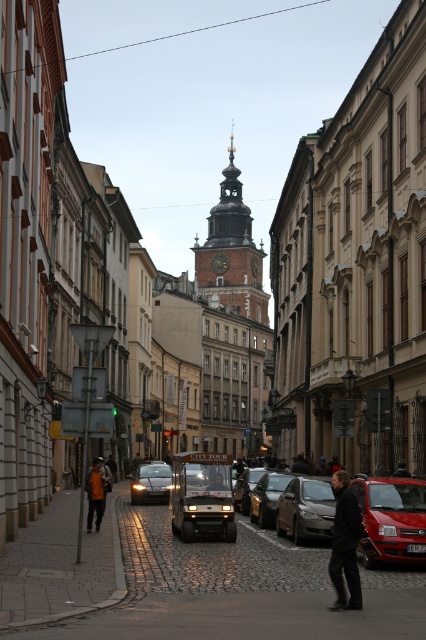
Question: Considering the real-world distances, which object is farthest from the dark gray jacket at center?

Choices:
 (A) shiny metallic car at center
 (B) matte gray sedan at center

Answer: (A)

Question: Is matte gray sedan at center positioned before dark brown leather jacket at center?

Choices:
 (A) no
 (B) yes

Answer: (B)

Question: Can you confirm if dark gray jacket at center is positioned to the right of shiny silver car at center?

Choices:
 (A) no
 (B) yes

Answer: (B)

Question: Which point is farther from the camera taking this photo?

Choices:
 (A) (406, 493)
 (B) (288, 531)
 (C) (100, 484)
 (D) (235, 173)

Answer: (D)

Question: Among these points, which one is farthest from the camera?

Choices:
 (A) (322, 525)
 (B) (412, 483)

Answer: (A)

Question: Is golden textured clock tower at center to the left of dark brown leather jacket at center from the viewer's perspective?

Choices:
 (A) no
 (B) yes

Answer: (B)